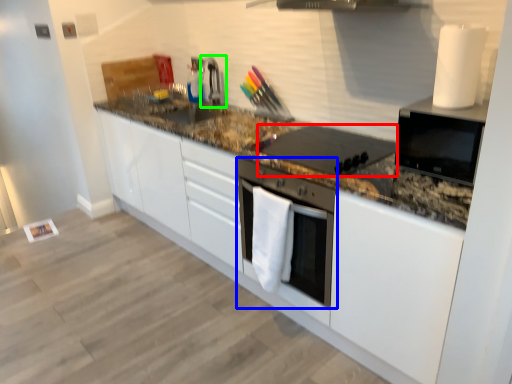
Question: Based on their relative distances, which object is nearer to kitchen appliance (highlighted by a red box)? Choose from home appliance (highlighted by a blue box) and faucet (highlighted by a green box).

Choices:
 (A) home appliance
 (B) faucet

Answer: (A)